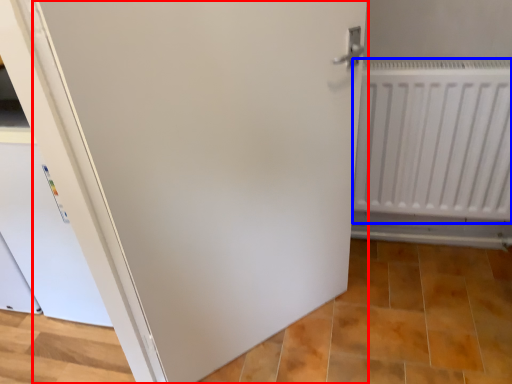
Question: Which object is closer to the camera taking this photo, door (highlighted by a red box) or radiator (highlighted by a blue box)?

Choices:
 (A) door
 (B) radiator

Answer: (A)